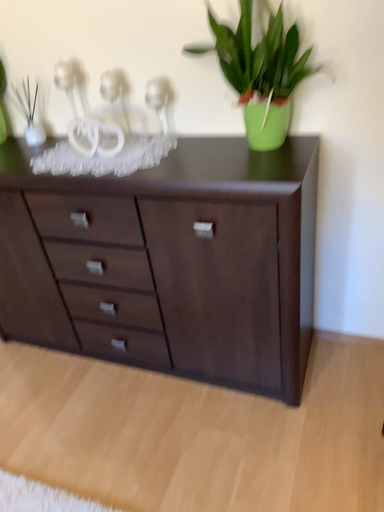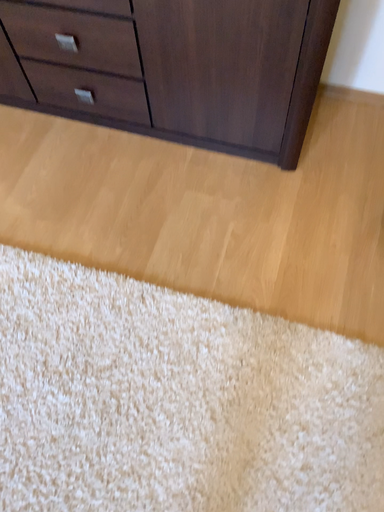
Question: Which way did the camera rotate in the video?

Choices:
 (A) rotated upward
 (B) rotated downward

Answer: (B)